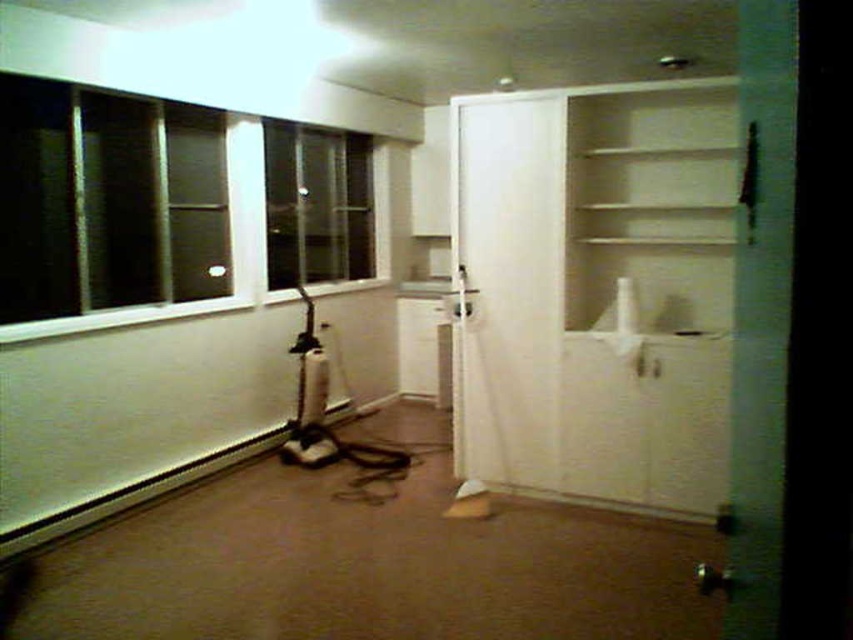
Question: Which point is farther to the camera?

Choices:
 (A) clear glass window at upper left
 (B) dark glass window at left

Answer: (A)

Question: Is the position of white matte cabinet at center less distant than that of clear glass window at upper left?

Choices:
 (A) no
 (B) yes

Answer: (B)

Question: Considering the real-world distances, which object is closest to the white matte cabinet at center?

Choices:
 (A) clear glass window at upper left
 (B) dark glass window at left

Answer: (B)

Question: Can you confirm if white matte cabinet at center is positioned below clear glass window at upper left?

Choices:
 (A) yes
 (B) no

Answer: (A)

Question: Which point is closer to the camera?

Choices:
 (A) (338, 220)
 (B) (119, 240)

Answer: (B)

Question: Can you confirm if white matte cabinet at center is thinner than clear glass window at upper left?

Choices:
 (A) no
 (B) yes

Answer: (A)